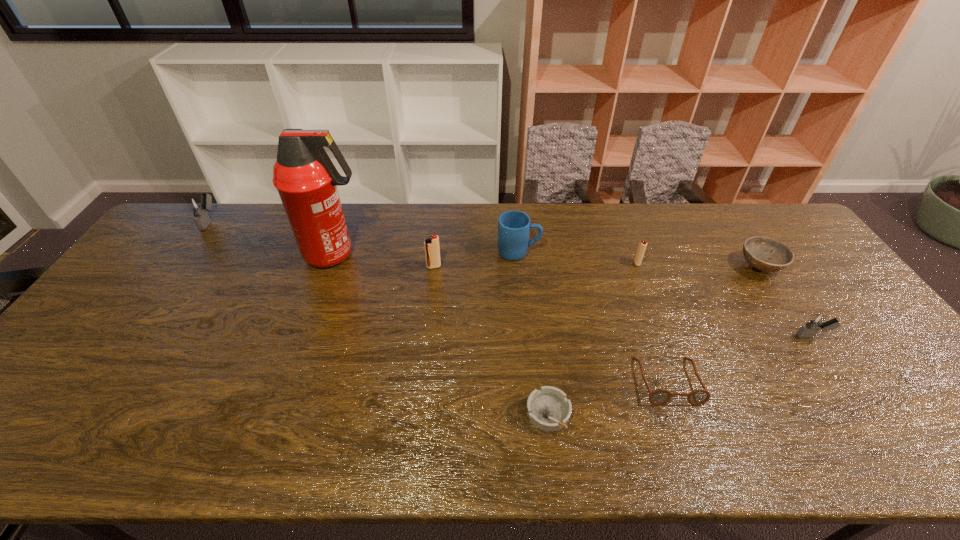
You are a GUI agent. You are given a task and a screenshot of the screen. Output one action in this format:
    pyautogui.click(x=<x>, y=<y>)
    Task: Click on the seventh farthest object
    The height and width of the screenshot is (540, 960).
    Given the screenshot: What is the action you would take?
    pyautogui.click(x=817, y=321)

Find the location of a particular element. bowl is located at coordinates tap(757, 250).

At what (x,y) coordinates should I click in order to perform the action: click on brown bowl. Please return your answer as a coordinate pair (x, y). This screenshot has width=960, height=540. Looking at the image, I should click on (757, 250).

The image size is (960, 540). I want to click on the second shortest object, so click(x=660, y=396).

Identify the location of the shortest object. The height and width of the screenshot is (540, 960). (548, 409).

Image resolution: width=960 pixels, height=540 pixels. In order to click on free location located on the trigger side of the tallest object in this screenshot , I will do pos(406,255).

At what (x,y) coordinates should I click in order to perform the action: click on free spot located 0.090m on the side of the mug with the handle. Please return your answer as a coordinate pair (x, y). Looking at the image, I should click on (568, 253).

The height and width of the screenshot is (540, 960). I want to click on vacant space located on the front of the farther gray igniter, so click(x=150, y=303).

The height and width of the screenshot is (540, 960). Find the location of `vacant space located 0.200m on the back of the seventh object from right to left`. vacant space located 0.200m on the back of the seventh object from right to left is located at coordinates (439, 225).

At what (x,y) coordinates should I click in order to perform the action: click on free region located on the right of the right red igniter. Please return your answer as a coordinate pair (x, y). Looking at the image, I should click on (726, 263).